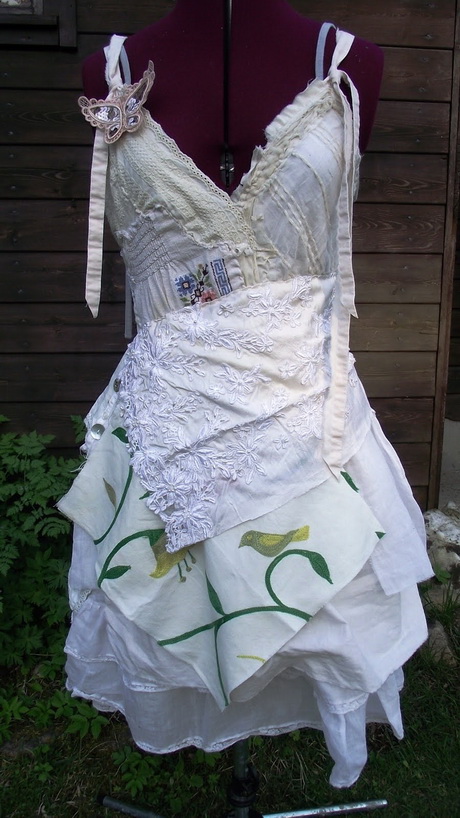
Identify the location of stand. (240, 762).